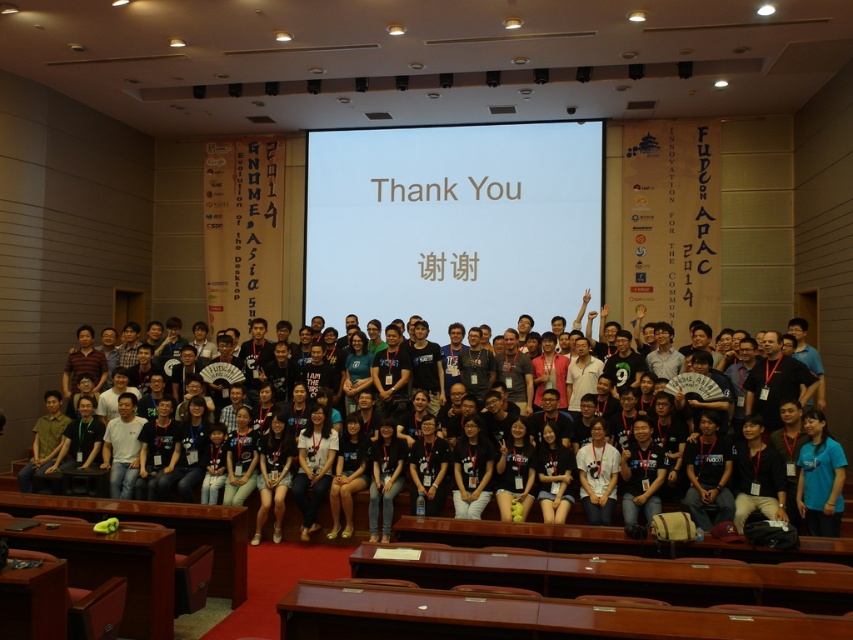
You are standing at the back of the lecture hall and want to take a photo of the white matte projection screen at center and the blue fabric shirt at lower right. Which object will appear larger in your photo?

The white matte projection screen at center will appear larger in your photo because it is closer to you than the blue fabric shirt at lower right, making it appear bigger in the image.

You are standing in the lecture hall and want to present a slide that requires the audience to be exactly 34 feet away from the white matte projection screen at center to view it clearly. Can the audience seated in their current positions view the slide clearly?

The white matte projection screen at center and viewer are 33.97 feet apart from each other, which is approximately 34 feet. Therefore, the audience seated in their current positions can view the slide clearly.